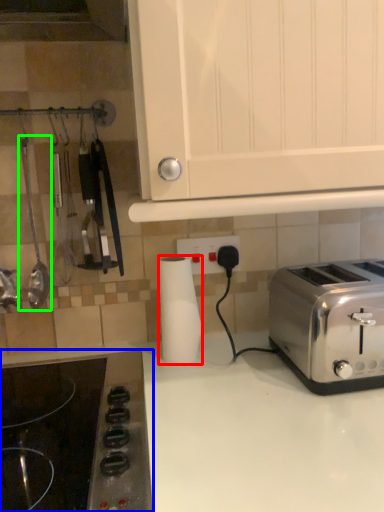
Question: Which object is the farthest from paper towel (highlighted by a red box)? Choose among these: gas stove (highlighted by a blue box) or appliance (highlighted by a green box).

Choices:
 (A) gas stove
 (B) appliance

Answer: (B)